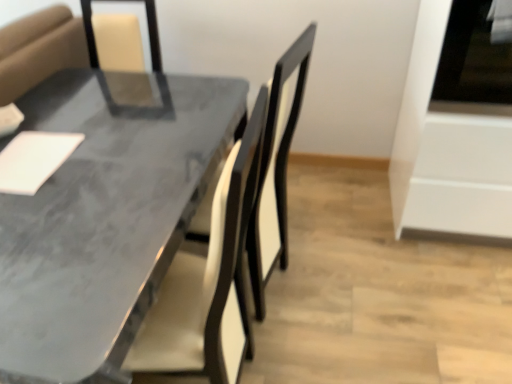
Describe the element at coordinates (105, 214) in the screenshot. This screenshot has height=384, width=512. I see `marble gray table at center` at that location.

You are a GUI agent. You are given a task and a screenshot of the screen. Output one action in this format:
    pyautogui.click(x=<x>, y=<y>)
    Task: Click on the marble gray table at center
    
    Given the screenshot: What is the action you would take?
    pyautogui.click(x=105, y=214)

Where is `white glossy oven at right`? This screenshot has height=384, width=512. white glossy oven at right is located at coordinates (448, 149).

Describe the element at coordinates (448, 149) in the screenshot. Image resolution: width=512 pixels, height=384 pixels. I see `white glossy oven at right` at that location.

At what (x,y) coordinates should I click in order to perform the action: click on marble gray table at center. Please return your answer as a coordinate pair (x, y). The height and width of the screenshot is (384, 512). Looking at the image, I should click on click(x=105, y=214).

Is marble gray table at center at the left side of white glossy oven at right?

Yes, marble gray table at center is to the left of white glossy oven at right.

Considering their positions, is marble gray table at center located in front of or behind white glossy oven at right?

Visually, marble gray table at center is located in front of white glossy oven at right.

Which is behind, point (114, 286) or point (506, 216)?

The point (506, 216) is farther from the camera.

From the image's perspective, is marble gray table at center over white glossy oven at right?

Actually, marble gray table at center appears below white glossy oven at right in the image.

From a real-world perspective, between marble gray table at center and white glossy oven at right, who is vertically higher?

In real-world perspective, white glossy oven at right is above.

Can you confirm if marble gray table at center is thinner than white glossy oven at right?

No, marble gray table at center is not thinner than white glossy oven at right.

Can you confirm if marble gray table at center is shorter than white glossy oven at right?

Yes, marble gray table at center is shorter than white glossy oven at right.

Can you confirm if marble gray table at center is smaller than white glossy oven at right?

Incorrect, marble gray table at center is not smaller in size than white glossy oven at right.

Choose the correct answer: Is marble gray table at center inside white glossy oven at right or outside it?

The correct answer is: outside.

Does marble gray table at center touch white glossy oven at right?

No, marble gray table at center is not next to white glossy oven at right.

Is marble gray table at center facing away from white glossy oven at right?

marble gray table at center does not have its back to white glossy oven at right.

In order to click on oven lying behind the marble gray table at center in this screenshot , I will do [448, 149].

Can you confirm if white glossy oven at right is positioned to the right of marble gray table at center?

Indeed, white glossy oven at right is positioned on the right side of marble gray table at center.

In the image, is white glossy oven at right positioned in front of or behind marble gray table at center?

In the image, white glossy oven at right appears behind marble gray table at center.

Considering the points (455, 106) and (183, 175), which point is behind, point (455, 106) or point (183, 175)?

The point (455, 106) is more distant.

From the image's perspective, between white glossy oven at right and marble gray table at center, who is located below?

marble gray table at center is shown below in the image.

From a real-world perspective, who is located lower, white glossy oven at right or marble gray table at center?

marble gray table at center is physically lower.

Looking at their sizes, would you say white glossy oven at right is wider or thinner than marble gray table at center?

white glossy oven at right is thinner than marble gray table at center.

Does white glossy oven at right have a lesser height compared to marble gray table at center?

In fact, white glossy oven at right may be taller than marble gray table at center.

Considering the sizes of objects white glossy oven at right and marble gray table at center in the image provided, who is bigger, white glossy oven at right or marble gray table at center?

Bigger between the two is marble gray table at center.

Is marble gray table at center located within white glossy oven at right?

Definitely not — marble gray table at center is not inside white glossy oven at right.

Can you see white glossy oven at right touching marble gray table at center?

No, white glossy oven at right is not with marble gray table at center.

Is white glossy oven at right positioned with its back to marble gray table at center?

white glossy oven at right is not turned away from marble gray table at center.

How many degrees apart are the facing directions of white glossy oven at right and marble gray table at center?

white glossy oven at right and marble gray table at center are facing 88 degrees away from each other.

Where is `oven to the right of marble gray table at center`? The height and width of the screenshot is (384, 512). oven to the right of marble gray table at center is located at coordinates (448, 149).

Find the location of a particular element. The height and width of the screenshot is (384, 512). oven behind the marble gray table at center is located at coordinates (448, 149).

In order to click on oven above the marble gray table at center (from the image's perspective) in this screenshot , I will do `click(448, 149)`.